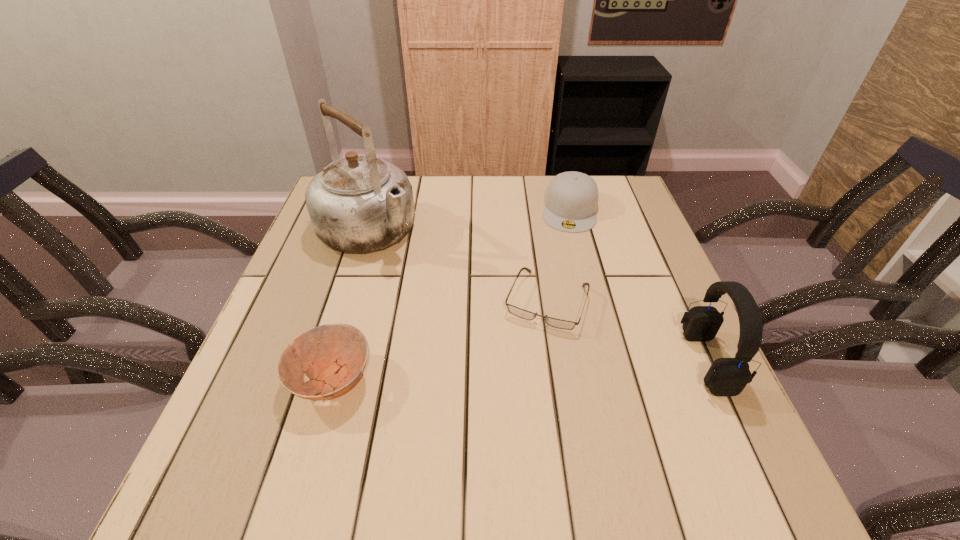
Locate an element on the screen. bowl situated at the left edge is located at coordinates (338, 352).

Where is `kettle present at the left edge`? Image resolution: width=960 pixels, height=540 pixels. kettle present at the left edge is located at coordinates (360, 203).

Where is `headset that is positioned at the right edge`? headset that is positioned at the right edge is located at coordinates [x=726, y=376].

Image resolution: width=960 pixels, height=540 pixels. In order to click on cap located in the right edge section of the desktop in this screenshot , I will do `click(571, 201)`.

Where is `object that is at the far left corner`? Image resolution: width=960 pixels, height=540 pixels. object that is at the far left corner is located at coordinates (360, 203).

What are the coordinates of `object located in the near left corner section of the desktop` in the screenshot? It's located at (338, 352).

Where is `object at the far right corner`? object at the far right corner is located at coordinates (571, 201).

Find the location of `object that is positioned at the near right corner`. object that is positioned at the near right corner is located at coordinates (726, 376).

In the image, there is a desktop. In order to click on vacant region at the far edge in this screenshot , I will do pyautogui.click(x=533, y=185).

Image resolution: width=960 pixels, height=540 pixels. I want to click on blank space at the near edge of the desktop, so click(424, 418).